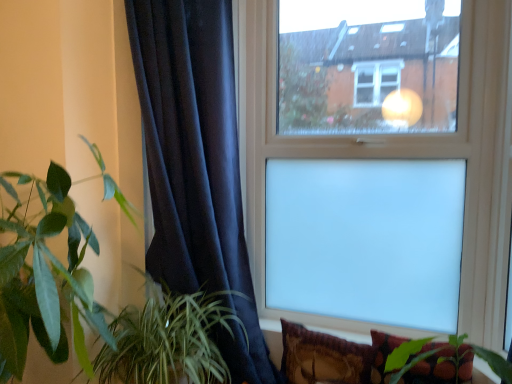
Question: From the image's perspective, does velvet-like brown pillow at lower right, positioned as the 2th pillow in right-to-left order, appear lower than green leafy plant at left, which is the 2th houseplant in right-to-left order?

Choices:
 (A) yes
 (B) no

Answer: (A)

Question: Considering the relative positions of velvet-like brown pillow at lower right, positioned as the 2th pillow in right-to-left order, and green leafy plant at left, acting as the first houseplant starting from the left, in the image provided, is velvet-like brown pillow at lower right, positioned as the 2th pillow in right-to-left order, to the left of green leafy plant at left, acting as the first houseplant starting from the left, from the viewer's perspective?

Choices:
 (A) yes
 (B) no

Answer: (B)

Question: From a real-world perspective, is velvet-like brown pillow at lower right, positioned as the 2th pillow in right-to-left order, on top of green leafy plant at left, acting as the first houseplant starting from the left?

Choices:
 (A) no
 (B) yes

Answer: (A)

Question: Does velvet-like brown pillow at lower right, positioned as the 2th pillow in right-to-left order, appear on the right side of green leafy plant at left, which is the 2th houseplant in right-to-left order?

Choices:
 (A) yes
 (B) no

Answer: (A)

Question: Does velvet-like brown pillow at lower right, positioned as the 2th pillow in right-to-left order, have a lesser height compared to green leafy plant at left, acting as the first houseplant starting from the left?

Choices:
 (A) yes
 (B) no

Answer: (A)

Question: Is the depth of velvet-like brown pillow at lower right, positioned as the 2th pillow in right-to-left order, less than that of green leafy plant at left, acting as the first houseplant starting from the left?

Choices:
 (A) yes
 (B) no

Answer: (B)

Question: From the image's perspective, is transparent glass window at upper center on top of velvet dark blue curtain at left?

Choices:
 (A) no
 (B) yes

Answer: (B)

Question: Is the depth of transparent glass window at upper center less than that of velvet dark blue curtain at left?

Choices:
 (A) yes
 (B) no

Answer: (B)

Question: From the image's perspective, is transparent glass window at upper center below velvet dark blue curtain at left?

Choices:
 (A) no
 (B) yes

Answer: (A)

Question: Is transparent glass window at upper center smaller than velvet dark blue curtain at left?

Choices:
 (A) yes
 (B) no

Answer: (A)

Question: Considering the relative sizes of transparent glass window at upper center and velvet dark blue curtain at left in the image provided, is transparent glass window at upper center shorter than velvet dark blue curtain at left?

Choices:
 (A) yes
 (B) no

Answer: (A)

Question: Could you tell me if transparent glass window at upper center is turned towards velvet dark blue curtain at left?

Choices:
 (A) no
 (B) yes

Answer: (B)

Question: Does velvet-like brown pillow at lower right, placed as the 1th pillow when sorted from left to right, appear on the right side of transparent glass window at upper center?

Choices:
 (A) yes
 (B) no

Answer: (B)